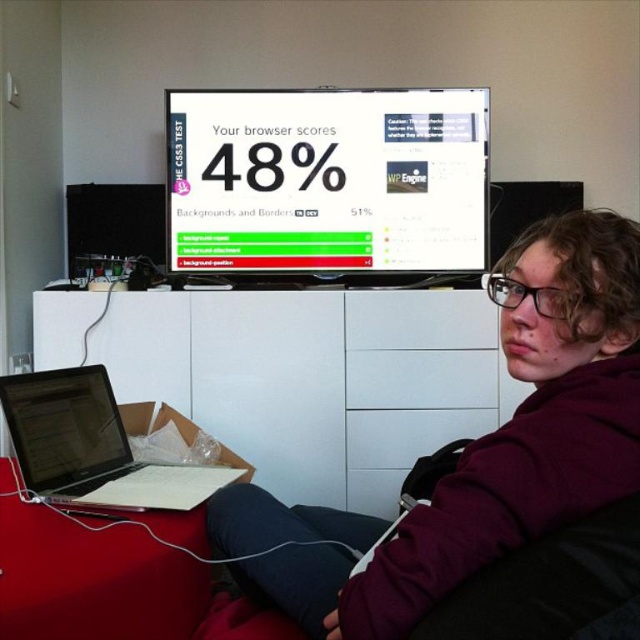
Is maroon hoodie at upper right smaller than matte black laptop at lower left?

Incorrect, maroon hoodie at upper right is not smaller in size than matte black laptop at lower left.

Can you confirm if maroon hoodie at upper right is thinner than matte black laptop at lower left?

No, maroon hoodie at upper right is not thinner than matte black laptop at lower left.

Who is more forward, (582, 342) or (106, 554)?

Point (582, 342) is in front.

The height and width of the screenshot is (640, 640). What are the coordinates of `maroon hoodie at upper right` in the screenshot? It's located at (502, 438).

Is white glossy computer screen at upper center below silver metallic laptop at lower left?

No.

Who is more distant from viewer, (236, 252) or (99, 420)?

Positioned behind is point (236, 252).

The height and width of the screenshot is (640, 640). In order to click on white glossy computer screen at upper center in this screenshot , I will do `click(326, 180)`.

You are a GUI agent. You are given a task and a screenshot of the screen. Output one action in this format:
    pyautogui.click(x=<x>, y=<y>)
    Task: Click on the white glossy computer screen at upper center
    The height and width of the screenshot is (640, 640).
    Given the screenshot: What is the action you would take?
    pyautogui.click(x=326, y=180)

Is maroon hoodie at upper right closer to the viewer compared to white glossy computer screen at upper center?

Yes, maroon hoodie at upper right is closer to the viewer.

Which of these two, maroon hoodie at upper right or white glossy computer screen at upper center, stands taller?

white glossy computer screen at upper center

Which is behind, point (534, 294) or point (234, 200)?

The point (234, 200) is more distant.

Locate an element on the screen. The image size is (640, 640). maroon hoodie at upper right is located at coordinates (502, 438).